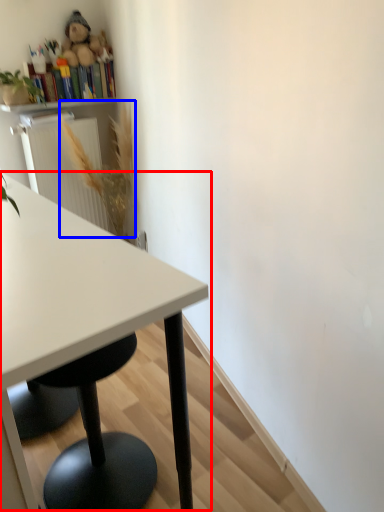
Question: Which of the following is the farthest to the observer, table (highlighted by a red box) or flower (highlighted by a blue box)?

Choices:
 (A) table
 (B) flower

Answer: (B)